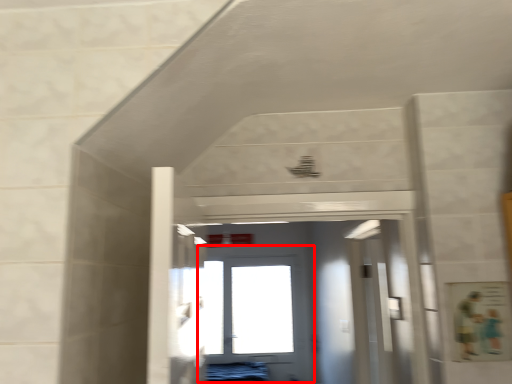
Question: From the image's perspective, considering the relative positions of door (annotated by the red box) and door in the image provided, where is door (annotated by the red box) located with respect to the staircase?

Choices:
 (A) below
 (B) above

Answer: (A)